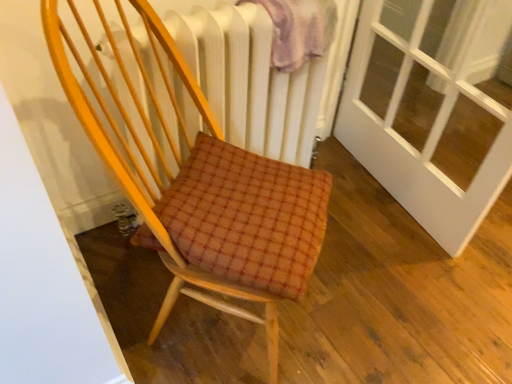
Where is `plush pink blanket at upper center`? The height and width of the screenshot is (384, 512). plush pink blanket at upper center is located at coordinates (298, 30).

Which object is thinner, wooden chair at center or plush pink blanket at upper center?

plush pink blanket at upper center is thinner.

Is wooden chair at center far from plush pink blanket at upper center?

No, wooden chair at center is in close proximity to plush pink blanket at upper center.

Is wooden chair at center oriented away from plush pink blanket at upper center?

No, wooden chair at center is not facing the opposite direction of plush pink blanket at upper center.

Based on the photo, is plush pink blanket at upper center at the right side of wooden chair at center?

Indeed, plush pink blanket at upper center is positioned on the right side of wooden chair at center.

Which of these two, plush pink blanket at upper center or wooden chair at center, stands taller?

With more height is wooden chair at center.

Considering the sizes of objects plush pink blanket at upper center and wooden chair at center in the image provided, who is thinner, plush pink blanket at upper center or wooden chair at center?

plush pink blanket at upper center is thinner.

From the image's perspective, is wooden chair at center beneath white textured radiator at upper center?

Correct, wooden chair at center appears lower than white textured radiator at upper center in the image.

Between wooden chair at center and white textured radiator at upper center, which one has smaller width?

white textured radiator at upper center is thinner.

Who is bigger, wooden chair at center or white textured radiator at upper center?

With larger size is wooden chair at center.

Can you confirm if wooden chair at center is positioned to the left of white textured radiator at upper center?

Indeed, wooden chair at center is positioned on the left side of white textured radiator at upper center.

Relative to wooden chair at center, is white textured radiator at upper center in front or behind?

Visually, white textured radiator at upper center is located behind wooden chair at center.

Does white textured radiator at upper center turn towards wooden chair at center?

Yes, white textured radiator at upper center is turned towards wooden chair at center.

Considering the sizes of objects white textured radiator at upper center and wooden chair at center in the image provided, who is bigger, white textured radiator at upper center or wooden chair at center?

wooden chair at center is bigger.

From a real-world perspective, is white textured radiator at upper center physically below wooden chair at center?

Indeed, from a real-world perspective, white textured radiator at upper center is positioned beneath wooden chair at center.

Is the position of plush pink blanket at upper center less distant than that of white textured radiator at upper center?

No, plush pink blanket at upper center is further to the viewer.

Considering the sizes of plush pink blanket at upper center and white textured radiator at upper center in the image, is plush pink blanket at upper center bigger or smaller than white textured radiator at upper center?

Considering their sizes, plush pink blanket at upper center takes up less space than white textured radiator at upper center.

Is plush pink blanket at upper center positioned with its back to white textured radiator at upper center?

Yes, white textured radiator at upper center is at the back of plush pink blanket at upper center.

Which point is more distant from viewer, (x=280, y=28) or (x=262, y=92)?

The point (x=262, y=92) is more distant.

From a real-world perspective, between white textured radiator at upper center and plush pink blanket at upper center, who is vertically lower?

white textured radiator at upper center.

From the image's perspective, does white textured radiator at upper center appear higher than plush pink blanket at upper center?

No.

Does point (111, 52) appear closer or farther from the camera than point (324, 48)?

Point (111, 52) appears to be closer to the viewer than point (324, 48).

Consider the image. Can you confirm if white textured radiator at upper center is bigger than plush pink blanket at upper center?

Yes.

Where is `blanket that appears above the wooden chair at center (from a real-world perspective)`? Image resolution: width=512 pixels, height=384 pixels. blanket that appears above the wooden chair at center (from a real-world perspective) is located at coordinates (298, 30).

Find the location of a particular element. The height and width of the screenshot is (384, 512). chair below the plush pink blanket at upper center (from a real-world perspective) is located at coordinates (206, 151).

Based on their spatial positions, is white textured radiator at upper center or plush pink blanket at upper center closer to wooden chair at center?

white textured radiator at upper center is positioned closer to the anchor wooden chair at center.

Based on their spatial positions, is wooden chair at center or white textured radiator at upper center closer to plush pink blanket at upper center?

Based on the image, white textured radiator at upper center appears to be nearer to plush pink blanket at upper center.

When comparing their distances from white textured radiator at upper center, does wooden chair at center or plush pink blanket at upper center seem closer?

wooden chair at center.

Looking at this image, based on their spatial positions, is plush pink blanket at upper center or wooden chair at center closer to white textured radiator at upper center?

wooden chair at center is positioned closer to the anchor white textured radiator at upper center.

Looking at the image, which one is located closer to wooden chair at center, plush pink blanket at upper center or white textured radiator at upper center?

Among the two, white textured radiator at upper center is located nearer to wooden chair at center.

Estimate the real-world distances between objects in this image. Which object is closer to plush pink blanket at upper center, white textured radiator at upper center or wooden chair at center?

white textured radiator at upper center is closer to plush pink blanket at upper center.

Where is `radiator between wooden chair at center and plush pink blanket at upper center along the z-axis`? radiator between wooden chair at center and plush pink blanket at upper center along the z-axis is located at coordinates (251, 81).